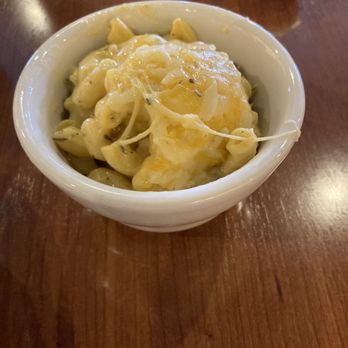
I want to click on light glares on table, so click(317, 179), click(24, 12).